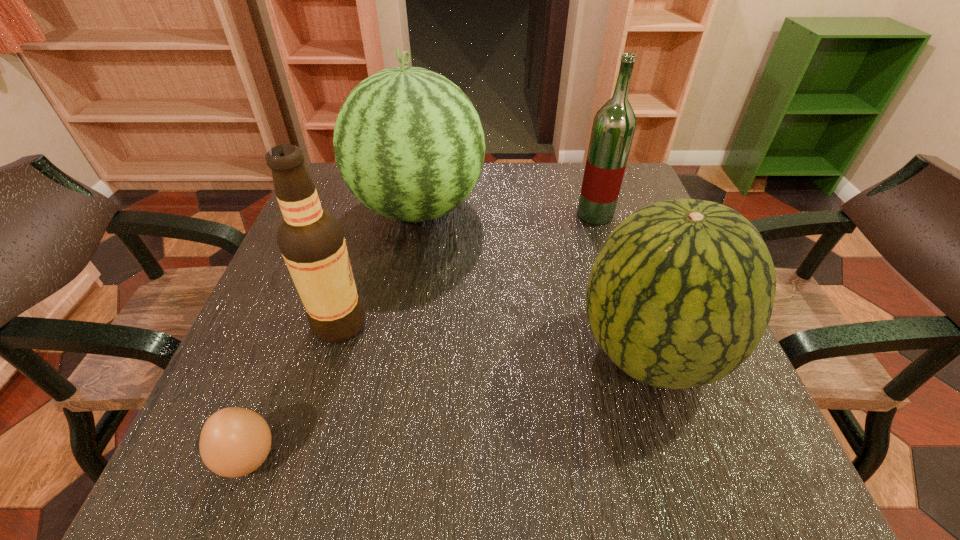
Where is `free space located 0.070m on the label of the alcohol`? free space located 0.070m on the label of the alcohol is located at coordinates (405, 324).

Find the location of `free spot located on the left of the second shortest object`. free spot located on the left of the second shortest object is located at coordinates (420, 353).

Locate an element on the screen. vacant space situated 0.210m on the right of the boiled egg is located at coordinates (427, 458).

Where is `liquor present at the far edge`? This screenshot has height=540, width=960. liquor present at the far edge is located at coordinates (613, 128).

At what (x,y) coordinates should I click in order to perform the action: click on watermelon that is at the far edge. Please return your answer as a coordinate pair (x, y). This screenshot has width=960, height=540. Looking at the image, I should click on coord(409,144).

You are a GUI agent. You are given a task and a screenshot of the screen. Output one action in this format:
    pyautogui.click(x=<x>, y=<y>)
    Task: Click on the object that is at the near edge
    The height and width of the screenshot is (540, 960).
    Given the screenshot: What is the action you would take?
    pyautogui.click(x=234, y=442)

Find the location of `watermelon at the left edge`. watermelon at the left edge is located at coordinates (409, 144).

At what (x,y) coordinates should I click in order to perform the action: click on alcohol at the left edge. Please return your answer as a coordinate pair (x, y). The image size is (960, 540). Looking at the image, I should click on (311, 240).

Where is `boiled egg that is at the left edge`? The height and width of the screenshot is (540, 960). boiled egg that is at the left edge is located at coordinates click(x=234, y=442).

This screenshot has height=540, width=960. Find the location of `liquor located at the right edge`. liquor located at the right edge is located at coordinates (613, 128).